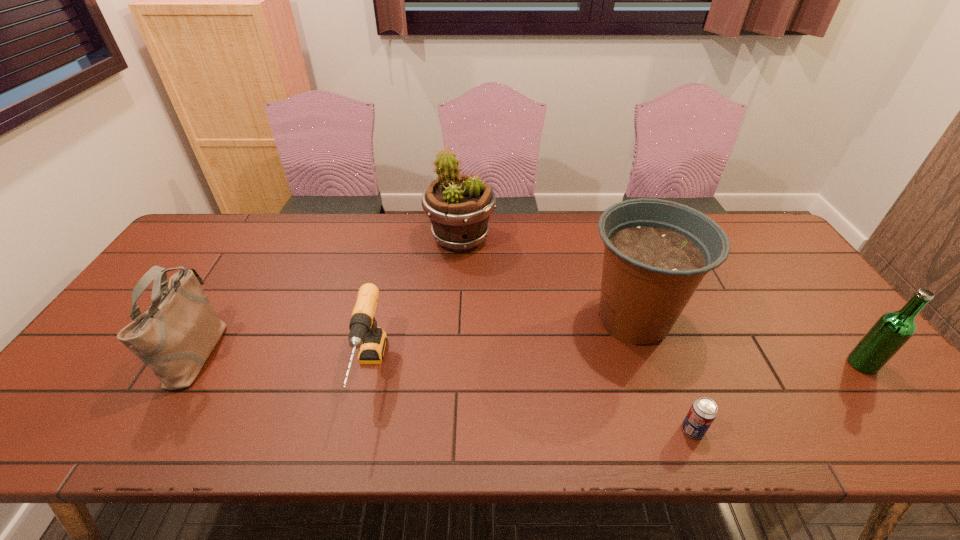
Where is `vacant space located on the front-facing side of the leftmost object`? vacant space located on the front-facing side of the leftmost object is located at coordinates (339, 351).

Locate an element on the screen. The image size is (960, 540). free region located 0.360m on the back of the rightmost object is located at coordinates (781, 262).

This screenshot has width=960, height=540. Find the location of `vacant space located on the back of the beer can`. vacant space located on the back of the beer can is located at coordinates (662, 352).

Locate an element on the screen. object at the far edge is located at coordinates (459, 207).

This screenshot has width=960, height=540. Find the location of `drill that is at the near edge`. drill that is at the near edge is located at coordinates coord(364,334).

Where is `beer can that is at the near edge`? The image size is (960, 540). beer can that is at the near edge is located at coordinates (703, 411).

Identify the location of object that is at the right edge. (892, 330).

The height and width of the screenshot is (540, 960). Identify the location of vacant space at the far edge. (333, 241).

Where is `vacant space at the left edge of the desktop`? The width and height of the screenshot is (960, 540). vacant space at the left edge of the desktop is located at coordinates (78, 406).

In the image, there is a desktop. Identify the location of vacant space at the far right corner. (745, 244).